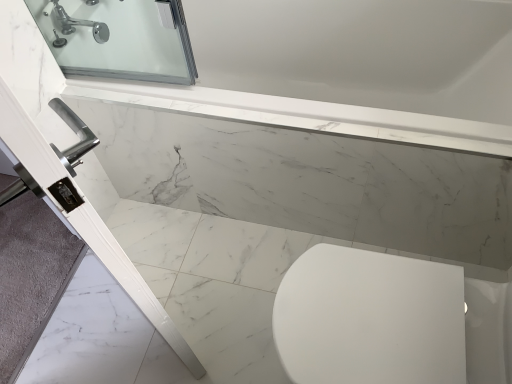
Question: Choose the correct answer: Is chrome metallic faucet at upper left inside white glossy bathtub at lower left or outside it?

Choices:
 (A) inside
 (B) outside

Answer: (B)

Question: Looking at their shapes, would you say chrome metallic faucet at upper left is wider or thinner than white glossy bathtub at lower left?

Choices:
 (A) thin
 (B) wide

Answer: (A)

Question: From a real-world perspective, is chrome metallic faucet at upper left above or below white glossy bathtub at lower left?

Choices:
 (A) above
 (B) below

Answer: (A)

Question: Is white glossy bathtub at lower left taller or shorter than chrome metallic faucet at upper left?

Choices:
 (A) tall
 (B) short

Answer: (B)

Question: In the image, is white glossy bathtub at lower left positioned in front of or behind chrome metallic faucet at upper left?

Choices:
 (A) behind
 (B) front

Answer: (B)

Question: Visually, is white glossy bathtub at lower left positioned to the left or to the right of chrome metallic faucet at upper left?

Choices:
 (A) left
 (B) right

Answer: (B)

Question: Is point (324, 120) closer or farther from the camera than point (64, 24)?

Choices:
 (A) closer
 (B) farther

Answer: (A)